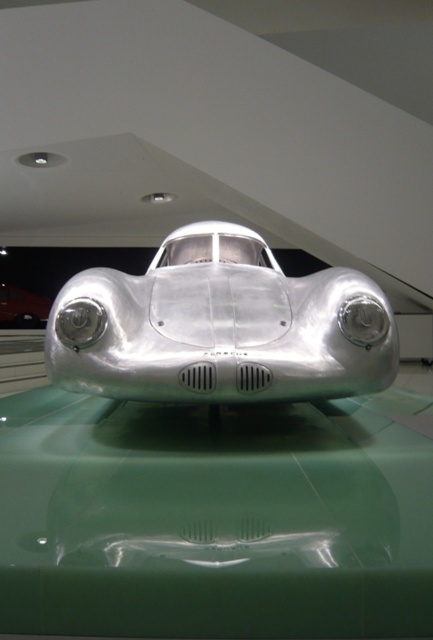
You are standing in front of a vintage racing car exhibit. The car is displayed on a green platform. There is a point marked at coordinates (219, 326). What object is located at this point?

The point at coordinates (219, 326) marks the silver metallic car at center.

You are a museum visitor standing in front of the vintage racing car display. You notice two silver cars at the center. Which one is closer to you, the silver metallic car at center or the polished silver car at center?

The silver metallic car at center is closer to you because it is in front of the polished silver car at center.